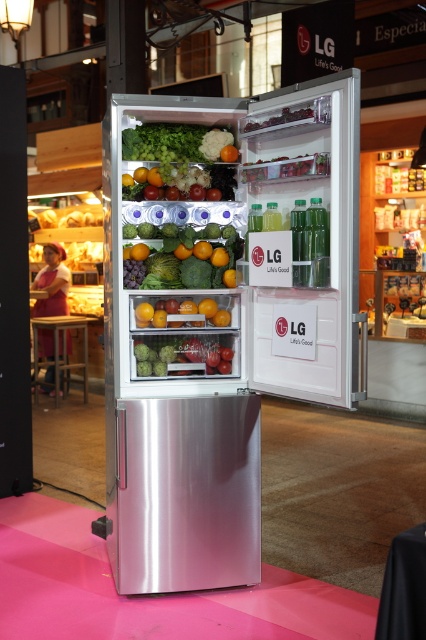
Who is more forward, (259, 280) or (126, 275)?

Positioned in front is point (259, 280).

Is point (328, 122) closer to viewer compared to point (126, 266)?

That is True.

Who is more forward, (181,390) or (161,280)?

Point (181,390)

Find the location of a particular element. satin silver refrigerator at center is located at coordinates click(224, 308).

Who is shorter, green matte cauliflower at upper center or smooth orange at center?

With less height is smooth orange at center.

Between green matte cauliflower at upper center and smooth orange at center, which one is positioned higher?

green matte cauliflower at upper center is higher up.

The height and width of the screenshot is (640, 426). What do you see at coordinates (181, 160) in the screenshot?
I see `green matte cauliflower at upper center` at bounding box center [181, 160].

At what (x,y) coordinates should I click in order to perform the action: click on green matte cauliflower at upper center. Please return your answer as a coordinate pair (x, y). This screenshot has height=640, width=426. Looking at the image, I should click on (181, 160).

This screenshot has height=640, width=426. What do you see at coordinates (224, 308) in the screenshot? I see `satin silver refrigerator at center` at bounding box center [224, 308].

Between satin silver refrigerator at center and smooth orange at center, which one has less height?

With less height is smooth orange at center.

Is point (224, 440) less distant than point (215, 324)?

Yes.

What are the coordinates of `satin silver refrigerator at center` in the screenshot? It's located at (224, 308).